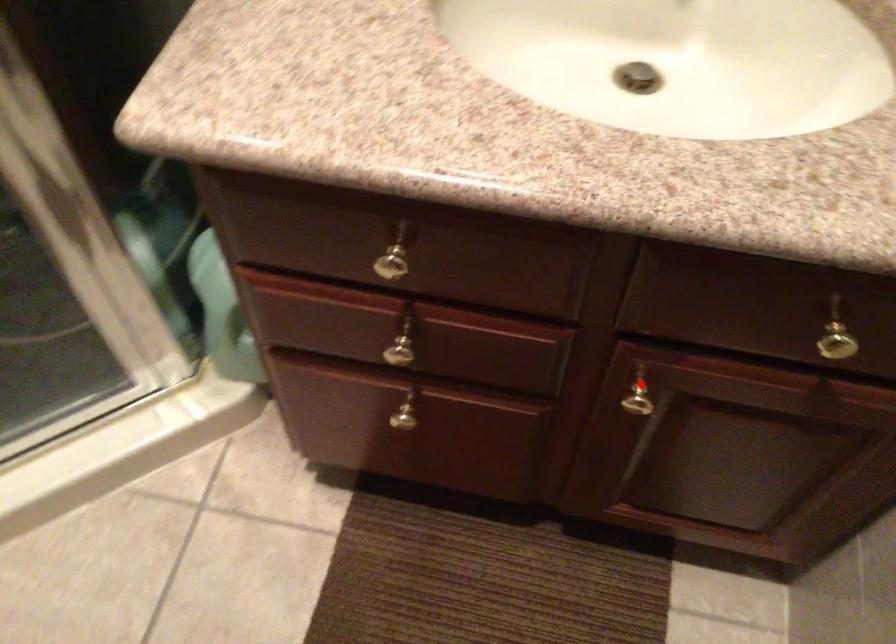
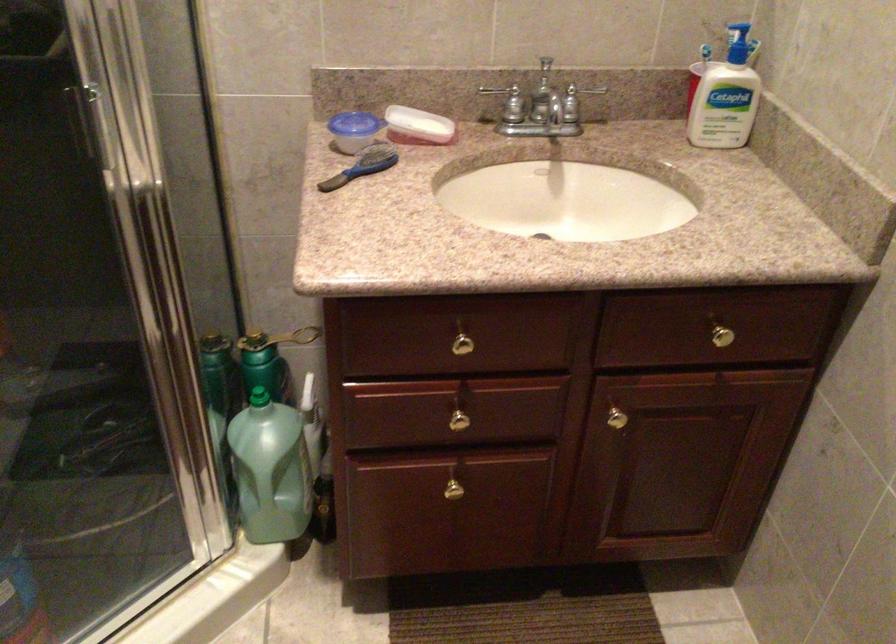
Question: I am providing you with two images of the same scene from different viewpoints. In image1, a red point is highlighted. Considering the same 3D point in image2, which of the following is correct?

Choices:
 (A) It is closer
 (B) It is farther

Answer: (B)